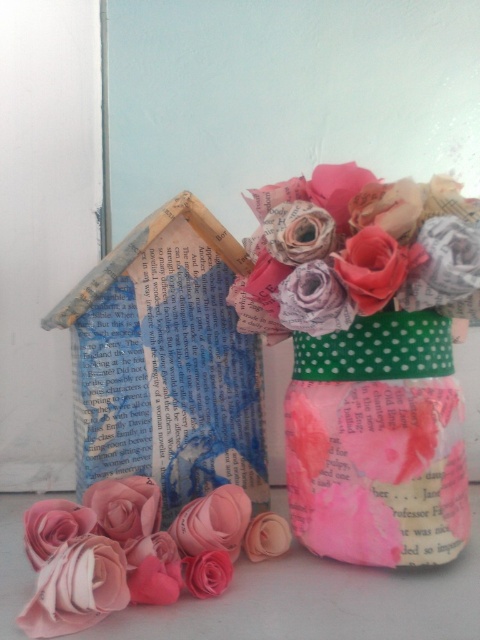
You are an artist who wants to display the matte paper flower at center and the pink paper flower at lower left in a way that highlights their size difference. Which flower should be placed closer to the viewer to make the size difference more apparent?

The matte paper flower at center, which is larger, should be placed closer to the viewer to emphasize its size difference compared to the pink paper flower at lower left.

You are an artist trying to arrange these flowers in a vase. The vase can only hold flowers that are wider than 10 cm. Based on the image, can you determine if the matte paper flower at center or the pink paper flower at lower left is more likely to fit in the vase?

The matte paper flower at center might be wider than pink paper flower at lower left, so it is more likely to fit in the vase if it exceeds 10 cm in width.